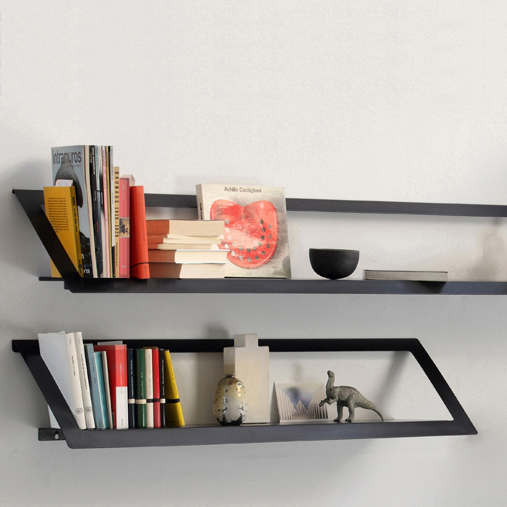
The height and width of the screenshot is (507, 507). I want to click on home decor, so click(x=230, y=402), click(x=256, y=375), click(x=305, y=395), click(x=346, y=394), click(x=338, y=262).